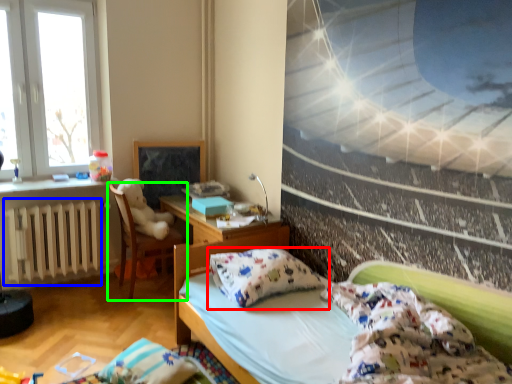
Question: Which object is the farthest from pillow (highlighted by a red box)? Choose among these: radiator (highlighted by a blue box) or chair (highlighted by a green box).

Choices:
 (A) radiator
 (B) chair

Answer: (A)